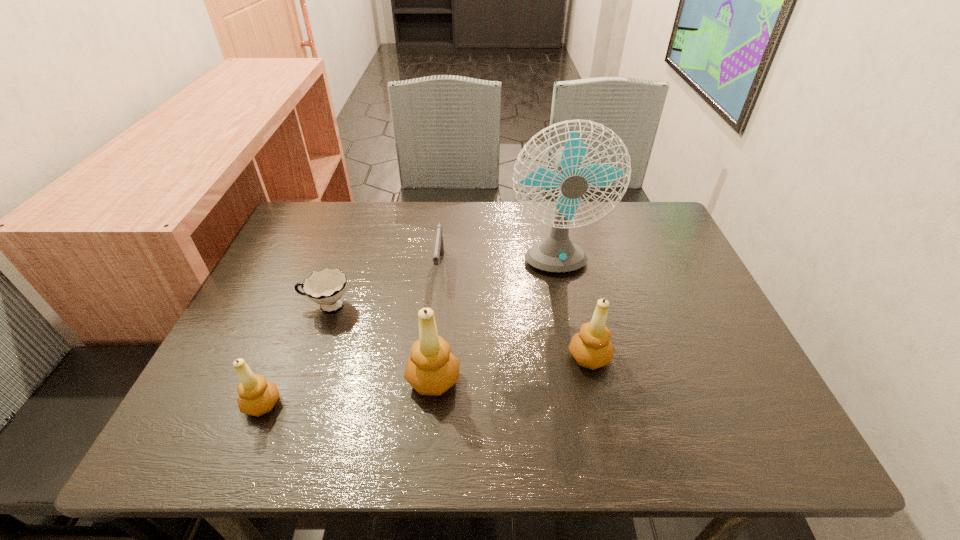
You are a GUI agent. You are given a task and a screenshot of the screen. Output one action in this format:
    pyautogui.click(x=<x>, y=<y>)
    Task: Click on the free space located on the back of the leftmost candle_holder
    This screenshot has width=960, height=540.
    Given the screenshot: What is the action you would take?
    pyautogui.click(x=311, y=286)

Where is `vacant space situated 0.260m on the left of the second candle_holder from left to right`? This screenshot has height=540, width=960. vacant space situated 0.260m on the left of the second candle_holder from left to right is located at coordinates (280, 380).

Identify the location of free space located 0.280m on the right of the rightmost candle_holder. The height and width of the screenshot is (540, 960). (742, 357).

At what (x,y) coordinates should I click in order to perform the action: click on free space located on the side of the shortest object with the handle. Please return your answer as a coordinate pair (x, y). Looking at the image, I should click on (264, 306).

You are a GUI agent. You are given a task and a screenshot of the screen. Output one action in this format:
    pyautogui.click(x=<x>, y=<y>)
    Task: Click on the vacant space located 0.070m on the side of the shortest object with the handle
    
    Given the screenshot: What is the action you would take?
    pyautogui.click(x=272, y=306)

Find the location of a particular element. This screenshot has height=540, width=960. blank area located 0.060m on the side of the shortest object with the handle is located at coordinates (276, 306).

Image resolution: width=960 pixels, height=540 pixels. I want to click on vacant region located 0.310m on the front-facing side of the fan, so click(x=578, y=394).

Locate an element on the screen. This screenshot has height=540, width=960. vacant space located 0.100m at the barrel of the pistol is located at coordinates (435, 316).

Identify the location of fan positioned at the far edge. This screenshot has width=960, height=540. (557, 253).

Find the location of a particular element. pistol that is positioned at the far edge is located at coordinates (438, 253).